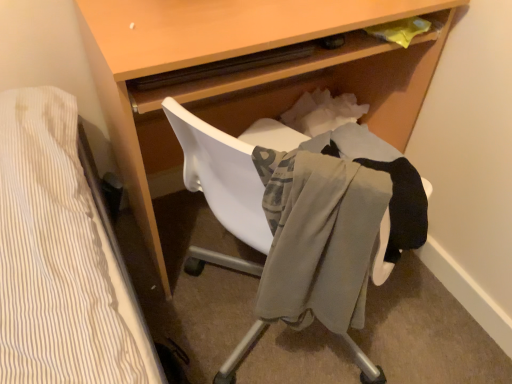
The width and height of the screenshot is (512, 384). What do you see at coordinates (245, 72) in the screenshot?
I see `light brown wood desk at center` at bounding box center [245, 72].

In order to face light brown wood desk at center, should I rotate leftwards or rightwards?

It's best to rotate right around 1.211 degrees.

What is the approximate width of light brown wood desk at center?

light brown wood desk at center is 17.75 inches in width.

The height and width of the screenshot is (384, 512). I want to click on light brown wood desk at center, so [245, 72].

The height and width of the screenshot is (384, 512). I want to click on light gray fabric at center, so click(391, 179).

The width and height of the screenshot is (512, 384). What do you see at coordinates (391, 179) in the screenshot? I see `light gray fabric at center` at bounding box center [391, 179].

This screenshot has height=384, width=512. In order to click on light brown wood desk at center in this screenshot , I will do `click(245, 72)`.

Is light gray fabric at center to the left of light brown wood desk at center from the viewer's perspective?

Incorrect, light gray fabric at center is not on the left side of light brown wood desk at center.

Does light gray fabric at center come behind light brown wood desk at center?

Yes.

Which point is more forward, (406,236) or (148,19)?

Positioned in front is point (406,236).

From the image's perspective, which one is positioned lower, light gray fabric at center or light brown wood desk at center?

light gray fabric at center.

From the picture: From a real-world perspective, who is located lower, light gray fabric at center or light brown wood desk at center?

light brown wood desk at center.

Which of these two, light gray fabric at center or light brown wood desk at center, is wider?

light brown wood desk at center is wider.

Can you confirm if light gray fabric at center is shorter than light brown wood desk at center?

Indeed, light gray fabric at center has a lesser height compared to light brown wood desk at center.

Looking at this image, considering the relative sizes of light gray fabric at center and light brown wood desk at center in the image provided, is light gray fabric at center bigger than light brown wood desk at center?

No.

Choose the correct answer: Is light gray fabric at center inside light brown wood desk at center or outside it?

light gray fabric at center is not enclosed by light brown wood desk at center.

Is light gray fabric at center placed right next to light brown wood desk at center?

They are not placed beside each other.

Is light gray fabric at center oriented towards light brown wood desk at center?

Yes, light gray fabric at center is facing light brown wood desk at center.

How different are the orientations of light gray fabric at center and light brown wood desk at center in degrees?

They differ by 138 degrees in their facing directions.

Identify the location of desk on the left of light gray fabric at center. Image resolution: width=512 pixels, height=384 pixels. (245, 72).

Between light brown wood desk at center and light gray fabric at center, which one appears on the right side from the viewer's perspective?

light gray fabric at center is more to the right.

Considering their positions, is light brown wood desk at center located in front of or behind light gray fabric at center?

light brown wood desk at center is positioned closer to the viewer than light gray fabric at center.

Which point is more forward, (212,9) or (411,168)?

The point (212,9) is in front.

From the image's perspective, is light brown wood desk at center positioned above or below light gray fabric at center?

From the image's perspective, light brown wood desk at center appears above light gray fabric at center.

From a real-world perspective, is light brown wood desk at center positioned under light gray fabric at center based on gravity?

Yes, from a real-world perspective, light brown wood desk at center is under light gray fabric at center.

Is light brown wood desk at center wider or thinner than light gray fabric at center?

In the image, light brown wood desk at center appears to be wider than light gray fabric at center.

Considering the relative sizes of light brown wood desk at center and light gray fabric at center in the image provided, is light brown wood desk at center taller than light gray fabric at center?

Yes, light brown wood desk at center is taller than light gray fabric at center.

From the picture: Considering the sizes of objects light brown wood desk at center and light gray fabric at center in the image provided, who is bigger, light brown wood desk at center or light gray fabric at center?

light brown wood desk at center is bigger.

Is light gray fabric at center located within light brown wood desk at center?

Definitely not — light gray fabric at center is not inside light brown wood desk at center.

Is light brown wood desk at center not close to light gray fabric at center?

That's not correct — light brown wood desk at center is a little close to light gray fabric at center.

Could you tell me if light brown wood desk at center is facing light gray fabric at center?

Yes.

Where is `desk on the left of the light gray fabric at center`? Image resolution: width=512 pixels, height=384 pixels. desk on the left of the light gray fabric at center is located at coordinates (245, 72).

Where is `clothing that is below the light brown wood desk at center (from the image's perspective)`? The image size is (512, 384). clothing that is below the light brown wood desk at center (from the image's perspective) is located at coordinates (391, 179).

Locate an element on the screen. desk in front of the light gray fabric at center is located at coordinates (245, 72).